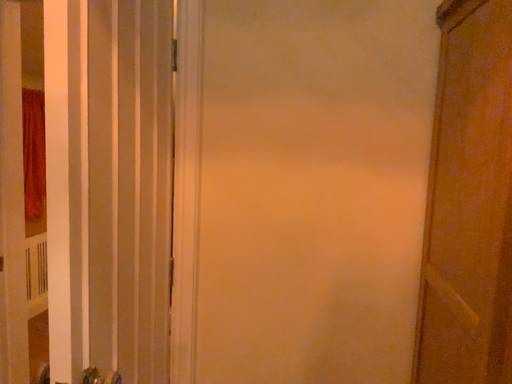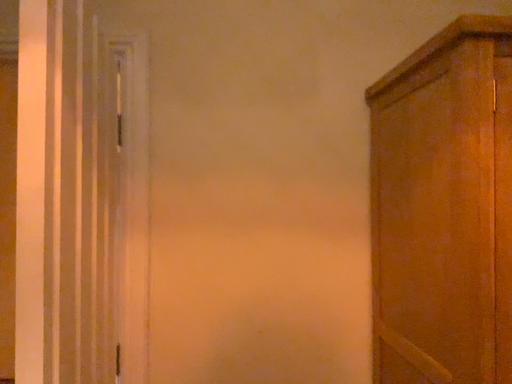
Question: Which way did the camera rotate in the video?

Choices:
 (A) rotated downward
 (B) rotated upward

Answer: (B)